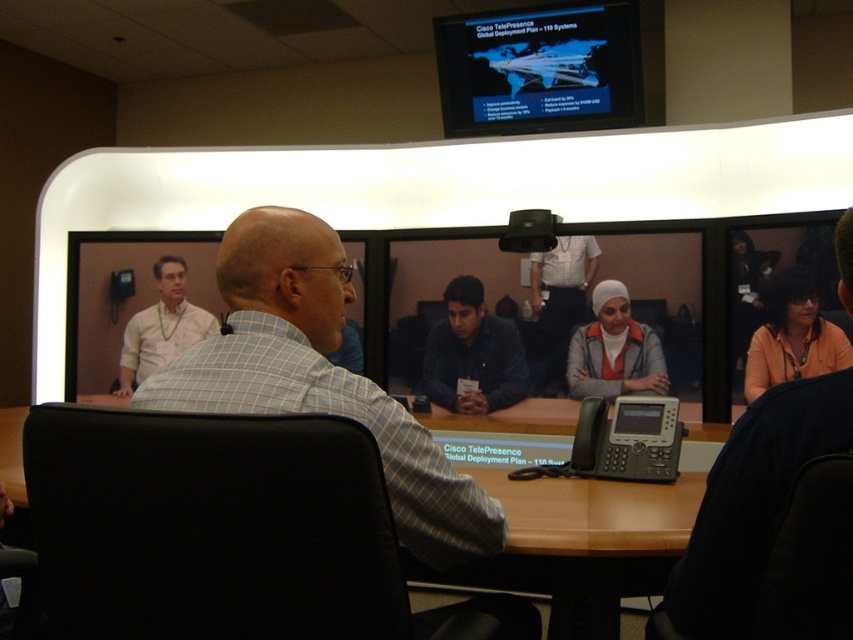
Between point (428, 385) and point (556, 262), which one is positioned in front?

Point (556, 262)

Can you confirm if matte black shirt at center is taller than dark blue shirt at center?

In fact, matte black shirt at center may be shorter than dark blue shirt at center.

What do you see at coordinates (473, 355) in the screenshot?
I see `matte black shirt at center` at bounding box center [473, 355].

This screenshot has width=853, height=640. In order to click on matte black shirt at center in this screenshot , I will do `click(473, 355)`.

Which of these two, brown wooden table at center or matte yellow shirt at upper left, stands taller?

matte yellow shirt at upper left

Can you confirm if brown wooden table at center is taller than matte yellow shirt at upper left?

Incorrect, brown wooden table at center's height is not larger of matte yellow shirt at upper left's.

Is point (643, 552) farther from camera compared to point (141, 358)?

No.

The width and height of the screenshot is (853, 640). Find the location of `brown wooden table at center`. brown wooden table at center is located at coordinates (595, 536).

The image size is (853, 640). What do you see at coordinates (540, 68) in the screenshot?
I see `matte black screen at upper center` at bounding box center [540, 68].

Is point (589, 76) in front of point (497, 378)?

Yes, point (589, 76) is closer to viewer.

Describe the element at coordinates (540, 68) in the screenshot. I see `matte black screen at upper center` at that location.

Where is `matte black screen at upper center`? matte black screen at upper center is located at coordinates pyautogui.click(x=540, y=68).